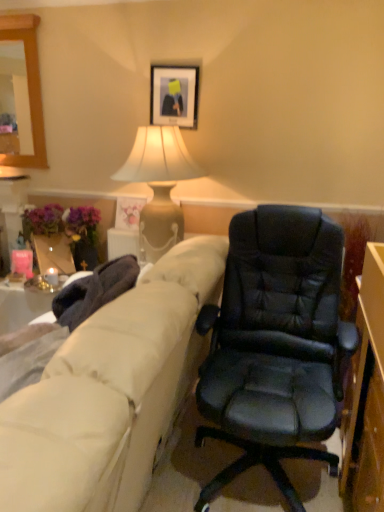
Question: Does black leather chair at center have a smaller size compared to beige fabric couch at left?

Choices:
 (A) no
 (B) yes

Answer: (B)

Question: Is black leather chair at center in contact with beige fabric couch at left?

Choices:
 (A) yes
 (B) no

Answer: (B)

Question: Is beige fabric couch at left located within black leather chair at center?

Choices:
 (A) yes
 (B) no

Answer: (B)

Question: Can you confirm if black leather chair at center is wider than beige fabric couch at left?

Choices:
 (A) yes
 (B) no

Answer: (B)

Question: Is black leather chair at center positioned with its back to beige fabric couch at left?

Choices:
 (A) no
 (B) yes

Answer: (A)

Question: From a real-world perspective, is black leather chair at center physically above beige fabric couch at left?

Choices:
 (A) yes
 (B) no

Answer: (B)

Question: From a real-world perspective, is matte beige lamp at upper center located beneath matte floral print picture frame at upper center, acting as the 1th picture frame starting from the left?

Choices:
 (A) no
 (B) yes

Answer: (A)

Question: Does matte beige lamp at upper center have a greater width compared to matte floral print picture frame at upper center, acting as the 1th picture frame starting from the left?

Choices:
 (A) yes
 (B) no

Answer: (A)

Question: Would you consider matte beige lamp at upper center to be distant from matte floral print picture frame at upper center, positioned as the 2th picture frame in right-to-left order?

Choices:
 (A) yes
 (B) no

Answer: (B)

Question: From the image's perspective, is matte beige lamp at upper center on top of matte floral print picture frame at upper center, positioned as the first picture frame in bottom-to-top order?

Choices:
 (A) no
 (B) yes

Answer: (B)

Question: Would you say matte beige lamp at upper center contains matte floral print picture frame at upper center, the 2th picture frame in the top-to-bottom sequence?

Choices:
 (A) no
 (B) yes

Answer: (A)

Question: Could you tell me if matte beige lamp at upper center is facing matte floral print picture frame at upper center, acting as the 1th picture frame starting from the left?

Choices:
 (A) no
 (B) yes

Answer: (A)

Question: Does matte beige lamp at upper center lie behind beige fabric couch at left?

Choices:
 (A) no
 (B) yes

Answer: (B)